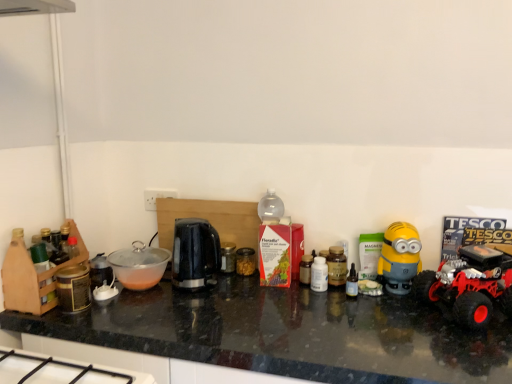
In order to click on blank area to the left of red rubber toy truck at right in this screenshot , I will do `click(398, 322)`.